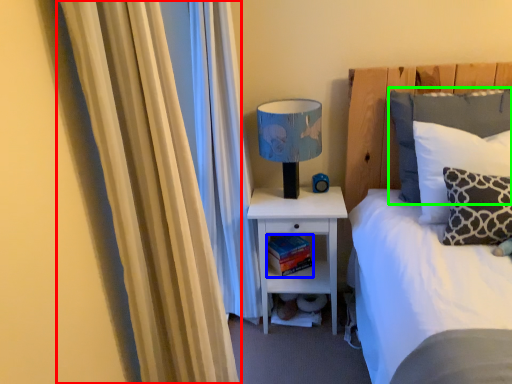
Question: Considering the real-world distances, which object is closest to curtain (highlighted by a red box)? book (highlighted by a blue box) or pillow (highlighted by a green box).

Choices:
 (A) book
 (B) pillow

Answer: (B)